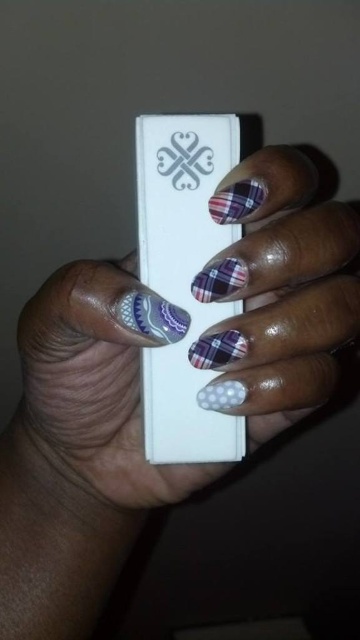
You are holding a white matte wii remote at center in your left hand and a polka dot nail polish at center in your right hand. Which object is wider?

The polka dot nail polish at center is wider than the white matte wii remote at center.

You are a nail artist and need to place a new design between the polka dot nail polish at center and the matte silver heart at center. According to the image, which object should be placed to the left of the other?

The polka dot nail polish at center is to the right of the matte silver heart at center, so the matte silver heart at center should be placed to the left of the polka dot nail polish at center.